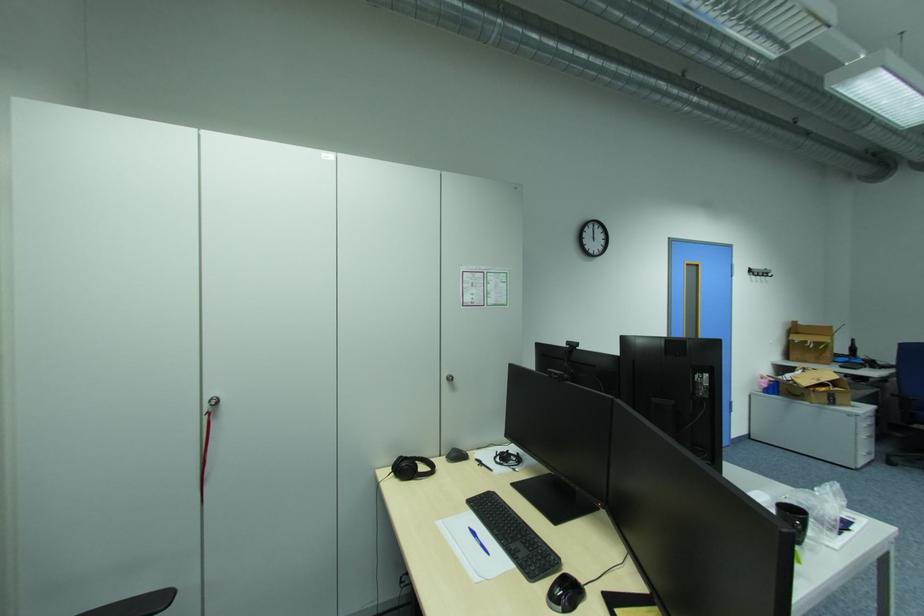
This screenshot has height=616, width=924. In order to click on cabinet lock in this screenshot , I will do `click(448, 378)`.